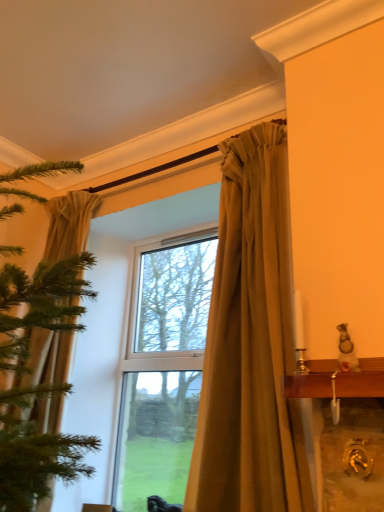
How much space does silky beige curtain at left, which appears as the first curtain when viewed from the left, occupy horizontally?

It is 11.97 inches.

The height and width of the screenshot is (512, 384). What do you see at coordinates (69, 225) in the screenshot?
I see `silky beige curtain at left, marked as the 2th curtain in a right-to-left arrangement` at bounding box center [69, 225].

What are the coordinates of `silky beige curtain at left, which appears as the first curtain when viewed from the left` in the screenshot? It's located at (69, 225).

Where is `matte gold curtain at center, which appears as the first curtain when viewed from the right`? This screenshot has width=384, height=512. matte gold curtain at center, which appears as the first curtain when viewed from the right is located at coordinates (250, 343).

This screenshot has height=512, width=384. Describe the element at coordinates (250, 343) in the screenshot. I see `matte gold curtain at center, the second curtain from the left` at that location.

Locate an element on the screen. Image resolution: width=384 pixels, height=512 pixels. silky beige curtain at left, marked as the 2th curtain in a right-to-left arrangement is located at coordinates (69, 225).

Visually, is silky beige curtain at left, marked as the 2th curtain in a right-to-left arrangement, positioned to the left or to the right of matte gold curtain at center, which appears as the first curtain when viewed from the right?

In the image, silky beige curtain at left, marked as the 2th curtain in a right-to-left arrangement, appears on the left side of matte gold curtain at center, which appears as the first curtain when viewed from the right.

Does silky beige curtain at left, marked as the 2th curtain in a right-to-left arrangement, lie in front of matte gold curtain at center, the second curtain from the left?

No, it is not.

Considering the positions of points (91, 205) and (261, 295), is point (91, 205) closer to camera compared to point (261, 295)?

That is False.

From the image's perspective, is silky beige curtain at left, marked as the 2th curtain in a right-to-left arrangement, located above matte gold curtain at center, the second curtain from the left?

No.

From a real-world perspective, is silky beige curtain at left, marked as the 2th curtain in a right-to-left arrangement, located higher than matte gold curtain at center, the second curtain from the left?

Actually, silky beige curtain at left, marked as the 2th curtain in a right-to-left arrangement, is physically below matte gold curtain at center, the second curtain from the left, in the real world.

Between silky beige curtain at left, which appears as the first curtain when viewed from the left, and matte gold curtain at center, which appears as the first curtain when viewed from the right, which one has larger width?

With larger width is silky beige curtain at left, which appears as the first curtain when viewed from the left.

Which of these two, silky beige curtain at left, marked as the 2th curtain in a right-to-left arrangement, or matte gold curtain at center, the second curtain from the left, stands taller?

With more height is silky beige curtain at left, marked as the 2th curtain in a right-to-left arrangement.

Is silky beige curtain at left, which appears as the first curtain when viewed from the left, smaller than matte gold curtain at center, the second curtain from the left?

No.

Does silky beige curtain at left, marked as the 2th curtain in a right-to-left arrangement, contain matte gold curtain at center, the second curtain from the left?

No.

Are silky beige curtain at left, marked as the 2th curtain in a right-to-left arrangement, and matte gold curtain at center, the second curtain from the left, making contact?

No.

Is silky beige curtain at left, marked as the 2th curtain in a right-to-left arrangement, positioned with its back to matte gold curtain at center, which appears as the first curtain when viewed from the right?

silky beige curtain at left, marked as the 2th curtain in a right-to-left arrangement, does not have its back to matte gold curtain at center, which appears as the first curtain when viewed from the right.

What's the angular difference between silky beige curtain at left, which appears as the first curtain when viewed from the left, and matte gold curtain at center, the second curtain from the left,'s facing directions?

The angular difference between silky beige curtain at left, which appears as the first curtain when viewed from the left, and matte gold curtain at center, the second curtain from the left, is 0.000357 degrees.

How distant is silky beige curtain at left, marked as the 2th curtain in a right-to-left arrangement, from matte gold curtain at center, which appears as the first curtain when viewed from the right?

silky beige curtain at left, marked as the 2th curtain in a right-to-left arrangement, is 1.11 meters away from matte gold curtain at center, which appears as the first curtain when viewed from the right.

Where is `curtain above the silky beige curtain at left, marked as the 2th curtain in a right-to-left arrangement (from the image's perspective)`? Image resolution: width=384 pixels, height=512 pixels. curtain above the silky beige curtain at left, marked as the 2th curtain in a right-to-left arrangement (from the image's perspective) is located at coordinates (250, 343).

Does matte gold curtain at center, which appears as the first curtain when viewed from the right, appear on the left side of silky beige curtain at left, which appears as the first curtain when viewed from the left?

No.

Between matte gold curtain at center, which appears as the first curtain when viewed from the right, and silky beige curtain at left, marked as the 2th curtain in a right-to-left arrangement, which one is positioned in front?

Positioned in front is matte gold curtain at center, which appears as the first curtain when viewed from the right.

Between point (252, 421) and point (88, 211), which one is positioned behind?

The point (88, 211) is more distant.

From the image's perspective, is matte gold curtain at center, which appears as the first curtain when viewed from the right, on top of silky beige curtain at left, marked as the 2th curtain in a right-to-left arrangement?

Indeed, from the image's perspective, matte gold curtain at center, which appears as the first curtain when viewed from the right, is shown above silky beige curtain at left, marked as the 2th curtain in a right-to-left arrangement.

From a real-world perspective, which is physically below, matte gold curtain at center, which appears as the first curtain when viewed from the right, or silky beige curtain at left, which appears as the first curtain when viewed from the left?

silky beige curtain at left, which appears as the first curtain when viewed from the left, is physically lower.

Consider the image. Is matte gold curtain at center, which appears as the first curtain when viewed from the right, wider or thinner than silky beige curtain at left, which appears as the first curtain when viewed from the left?

Clearly, matte gold curtain at center, which appears as the first curtain when viewed from the right, has less width compared to silky beige curtain at left, which appears as the first curtain when viewed from the left.

Who is shorter, matte gold curtain at center, which appears as the first curtain when viewed from the right, or silky beige curtain at left, marked as the 2th curtain in a right-to-left arrangement?

Standing shorter between the two is matte gold curtain at center, which appears as the first curtain when viewed from the right.

Does matte gold curtain at center, the second curtain from the left, have a smaller size compared to silky beige curtain at left, which appears as the first curtain when viewed from the left?

Indeed, matte gold curtain at center, the second curtain from the left, has a smaller size compared to silky beige curtain at left, which appears as the first curtain when viewed from the left.

Is matte gold curtain at center, which appears as the first curtain when viewed from the right, positioned beyond the bounds of silky beige curtain at left, marked as the 2th curtain in a right-to-left arrangement?

matte gold curtain at center, which appears as the first curtain when viewed from the right, lies outside silky beige curtain at left, marked as the 2th curtain in a right-to-left arrangement,'s area.

Is matte gold curtain at center, the second curtain from the left, positioned far away from silky beige curtain at left, marked as the 2th curtain in a right-to-left arrangement?

matte gold curtain at center, the second curtain from the left, is positioned a significant distance from silky beige curtain at left, marked as the 2th curtain in a right-to-left arrangement.

Is matte gold curtain at center, which appears as the first curtain when viewed from the right, looking in the opposite direction of silky beige curtain at left, which appears as the first curtain when viewed from the left?

No.

The image size is (384, 512). I want to click on curtain that appears above the silky beige curtain at left, marked as the 2th curtain in a right-to-left arrangement (from a real-world perspective), so click(x=250, y=343).

In the image, there is a matte gold curtain at center, which appears as the first curtain when viewed from the right. Identify the location of curtain below it (from the image's perspective). This screenshot has height=512, width=384. (69, 225).

I want to click on curtain that appears in front of the silky beige curtain at left, which appears as the first curtain when viewed from the left, so click(250, 343).